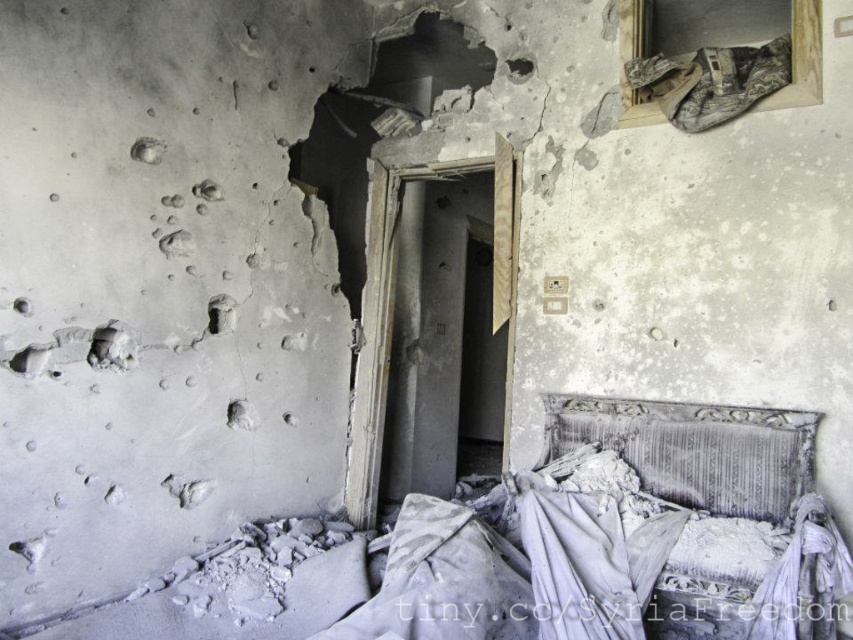
Based on the photo, who is shorter, charred fabric bed at lower right or worn fabric pillow at lower right?

worn fabric pillow at lower right is shorter.

Is point (630, 449) farther from camera compared to point (761, 412)?

Yes, point (630, 449) is farther from viewer.

In order to click on charred fabric bed at lower right in this screenshot , I will do `click(708, 515)`.